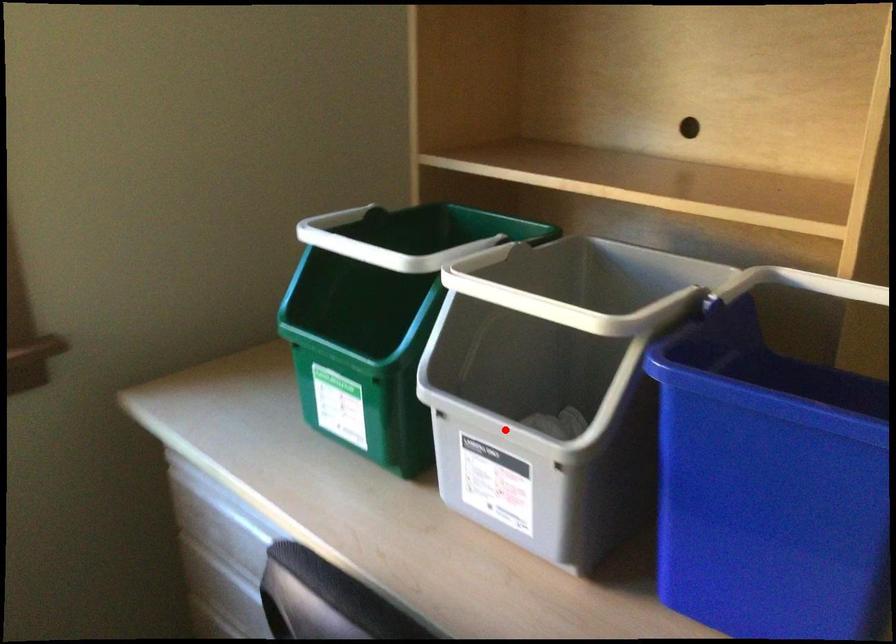
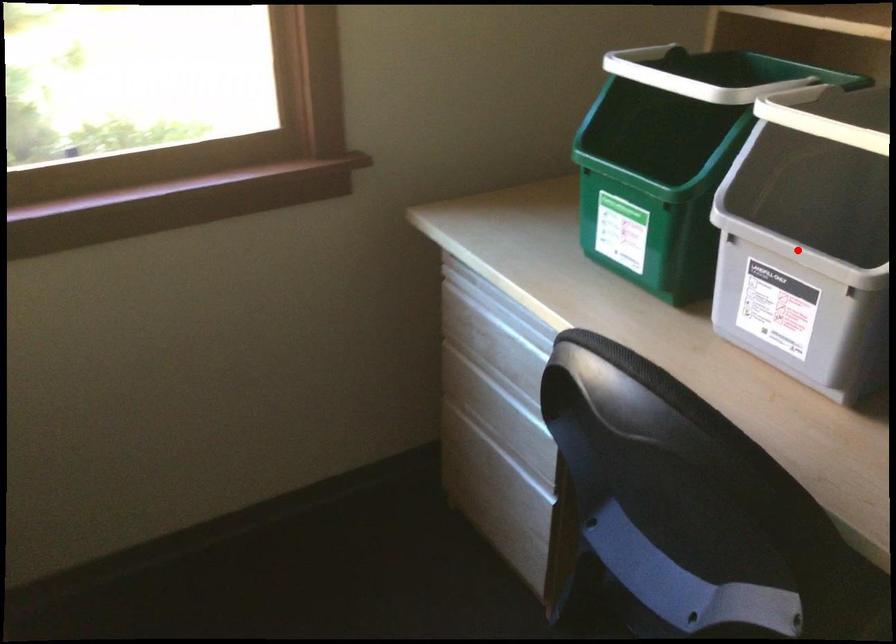
I am providing you with two images of the same scene from different viewpoints. A red point is marked on the first image and another point is marked on the second image. Is the marked point in image1 the same physical position as the marked point in image2?

Yes